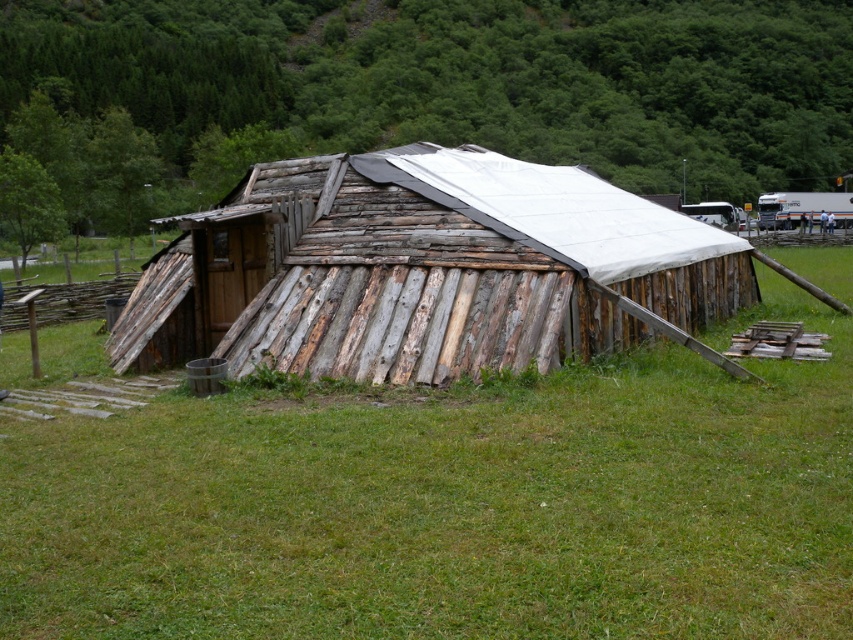
Question: Which point is closer to the camera taking this photo?

Choices:
 (A) (343, 337)
 (B) (618, 476)
 (C) (517, 16)

Answer: (B)

Question: Among these objects, which one is nearest to the camera?

Choices:
 (A) weathered wood barn at center
 (B) green leafy hillside at upper center
 (C) green grassy at center

Answer: (C)

Question: Is green grassy at center closer to the viewer compared to green leafy hillside at upper center?

Choices:
 (A) no
 (B) yes

Answer: (B)

Question: Where is green grassy at center located in relation to weathered wood barn at center in the image?

Choices:
 (A) above
 (B) below

Answer: (B)

Question: Does green grassy at center lie behind weathered wood barn at center?

Choices:
 (A) yes
 (B) no

Answer: (B)

Question: Which is nearer to the green leafy hillside at upper center?

Choices:
 (A) weathered wood barn at center
 (B) green grassy at center

Answer: (A)